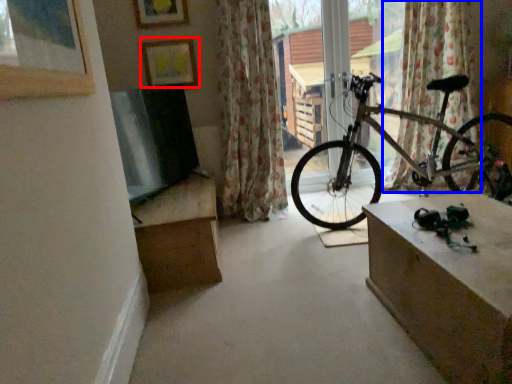
Question: Which object appears farthest to the camera in this image, picture frame (highlighted by a red box) or curtain (highlighted by a blue box)?

Choices:
 (A) picture frame
 (B) curtain

Answer: (A)